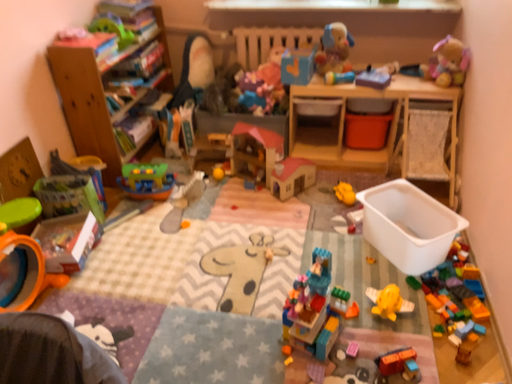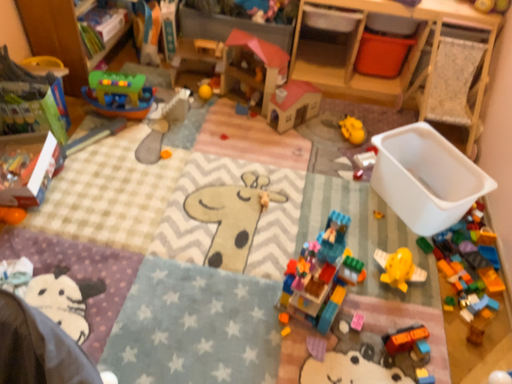
Question: How did the camera likely rotate when shooting the video?

Choices:
 (A) rotated upward
 (B) rotated downward

Answer: (B)